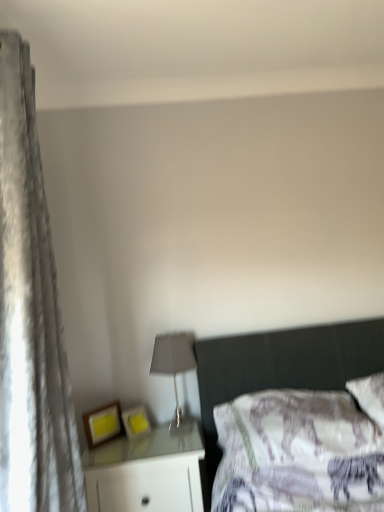
Locate an element on the screen. Image resolution: width=384 pixels, height=512 pixels. empty space that is to the right of matte yellow picture frame at lower center, the 2th picture frame in the left-to-right sequence is located at coordinates (166, 425).